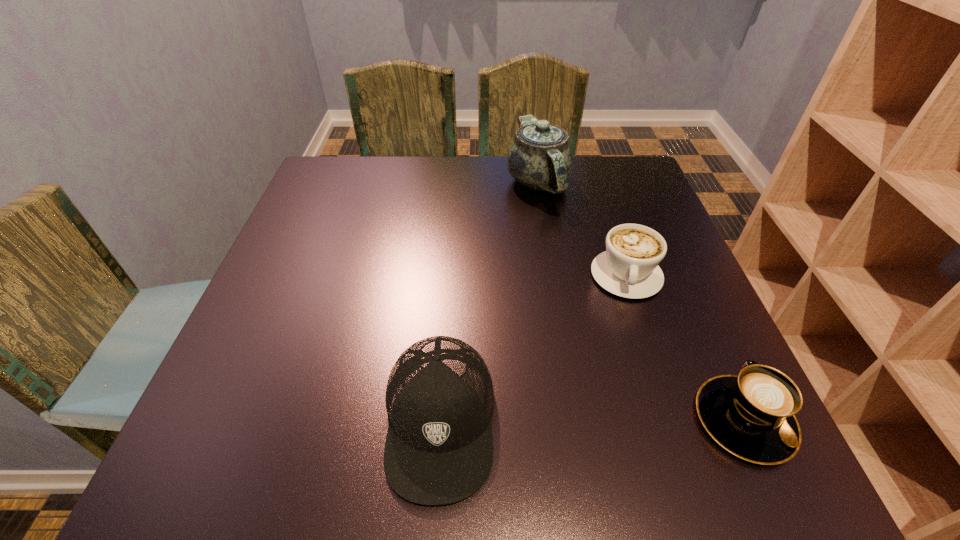
In order to click on free space located to the right of the farther cappuccino's handle in this screenshot , I will do `click(632, 379)`.

Where is `vacant space located 0.090m to the right of the farther cappuccino's handle`? The height and width of the screenshot is (540, 960). vacant space located 0.090m to the right of the farther cappuccino's handle is located at coordinates (630, 338).

The height and width of the screenshot is (540, 960). Identify the location of free space located to the right of the farther cappuccino's handle. (634, 421).

In order to click on object that is positioned at the far edge in this screenshot , I will do `click(540, 158)`.

Locate an element on the screen. cap positioned at the near edge is located at coordinates (439, 398).

This screenshot has height=540, width=960. I want to click on cappuccino present at the near edge, so click(752, 415).

Find the location of `object that is positioned at the near right corner`. object that is positioned at the near right corner is located at coordinates (752, 415).

This screenshot has height=540, width=960. In order to click on vacant region at the far edge of the desktop in this screenshot , I will do `click(425, 171)`.

Image resolution: width=960 pixels, height=540 pixels. In the image, there is a desktop. Identify the location of free space at the near edge. (307, 404).

Identify the location of vacant space at the left edge of the desktop. The image size is (960, 540). pos(238,342).